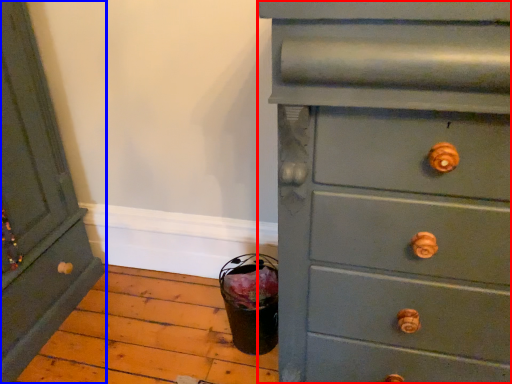
Question: Which object appears closest to the camera in this image, chest of drawers (highlighted by a red box) or chest of drawers (highlighted by a blue box)?

Choices:
 (A) chest of drawers
 (B) chest of drawers

Answer: (A)